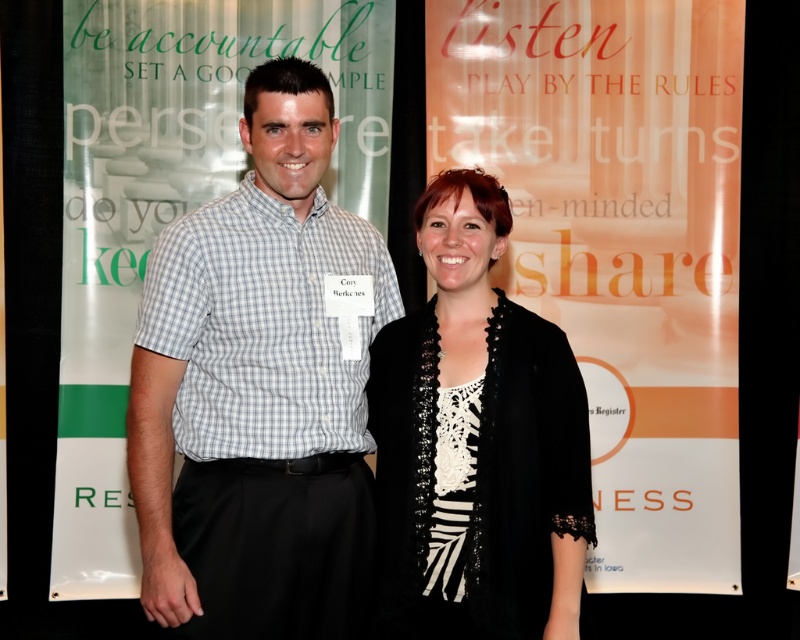
You are a photographer who needs to ensure that both the checkered fabric shirt at center and the black lace top at center are clearly visible in the photo. Based on their current positions, is there a risk that one might cover the other?

The checkered fabric shirt at center is positioned over the black lace top at center, so there is a risk that the checkered fabric shirt at center may cover the black lace top at center in the photo.

Based on the scene description, where is the point at coordinates (258, 392) located?

The point at coordinates (258, 392) corresponds to the checkered fabric shirt at center.

You are organizing a clothing donation drive and need to categorize items by size. You have a checkered fabric shirt at center and a black lace top at center. Which item should you place in the large size bin?

The checkered fabric shirt at center is larger in size than the black lace top at center, so the checkered fabric shirt at center should be placed in the large size bin.